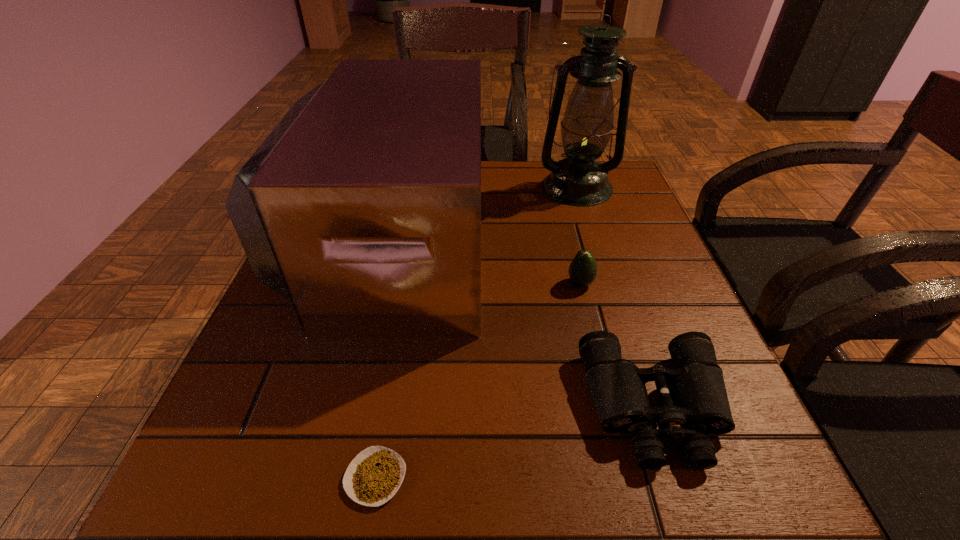
In order to click on microwave oven at the far edge in this screenshot , I will do `click(362, 207)`.

Find the location of a particular element. The image size is (960, 540). binoculars that is at the near edge is located at coordinates (694, 402).

This screenshot has width=960, height=540. In order to click on legume located at the near edge in this screenshot , I will do `click(374, 476)`.

You are a GUI agent. You are given a task and a screenshot of the screen. Output one action in this format:
    pyautogui.click(x=<x>, y=<y>)
    Task: Click on the object situated at the left edge
    The width and height of the screenshot is (960, 540).
    Given the screenshot: What is the action you would take?
    pyautogui.click(x=362, y=207)

Find the location of a particular element. Image resolution: width=960 pixels, height=540 pixels. oil lamp that is at the right edge is located at coordinates (578, 180).

Find the location of a particular element. binoculars that is at the right edge is located at coordinates (694, 402).

Find the location of a particular element. object that is positioned at the far left corner is located at coordinates (362, 207).

Locate an element on the screen. object positioned at the far right corner is located at coordinates (578, 180).

You are a GUI agent. You are given a task and a screenshot of the screen. Output one action in this format:
    pyautogui.click(x=<x>, y=<y>)
    Task: Click on the object present at the near right corner
    
    Given the screenshot: What is the action you would take?
    pyautogui.click(x=694, y=402)

Where is `free space at the far edge`? free space at the far edge is located at coordinates (516, 163).